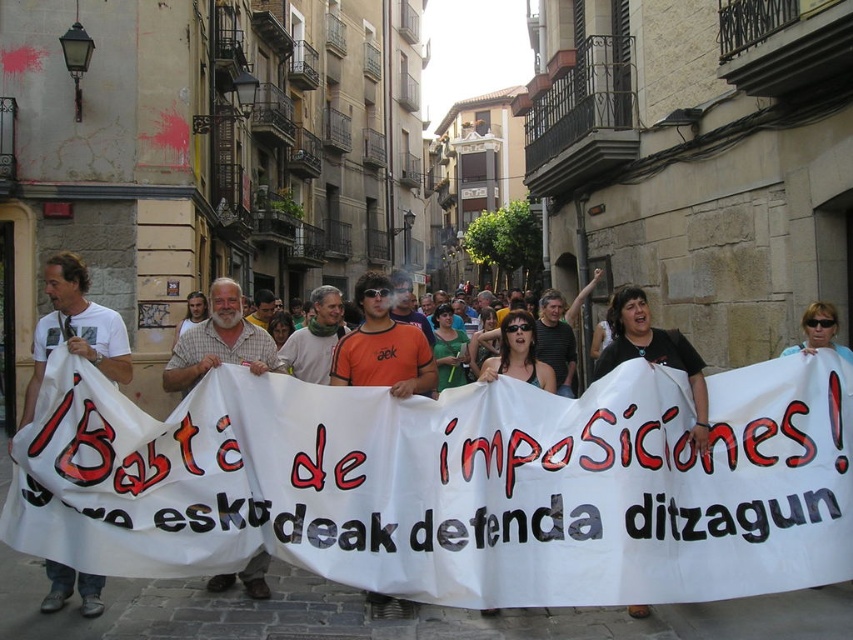
Based on the photo, which of these two, white t-shirt at center or plaid cotton shirt at center, stands shorter?

With less height is plaid cotton shirt at center.

Does point (80, 595) come in front of point (256, 561)?

Yes, it is.

Which is in front, point (119, 368) or point (216, 353)?

Point (119, 368) is in front.

Image resolution: width=853 pixels, height=640 pixels. Find the location of `white t-shirt at center`. white t-shirt at center is located at coordinates (74, 328).

Looking at this image, is plaid cotton shirt at center above black matte shirt at center?

No.

At what (x,y) coordinates should I click in order to perform the action: click on plaid cotton shirt at center. Please return your answer as a coordinate pair (x, y). The image size is (853, 640). Looking at the image, I should click on (218, 340).

Based on the photo, who is lower down, white t-shirt at center or black matte shirt at center?

black matte shirt at center is lower down.

Based on the photo, is white t-shirt at center closer to camera compared to black matte shirt at center?

That is False.

Which is in front, point (68, 291) or point (699, 378)?

Point (699, 378) is more forward.

In order to click on white t-shirt at center in this screenshot , I will do `click(74, 328)`.